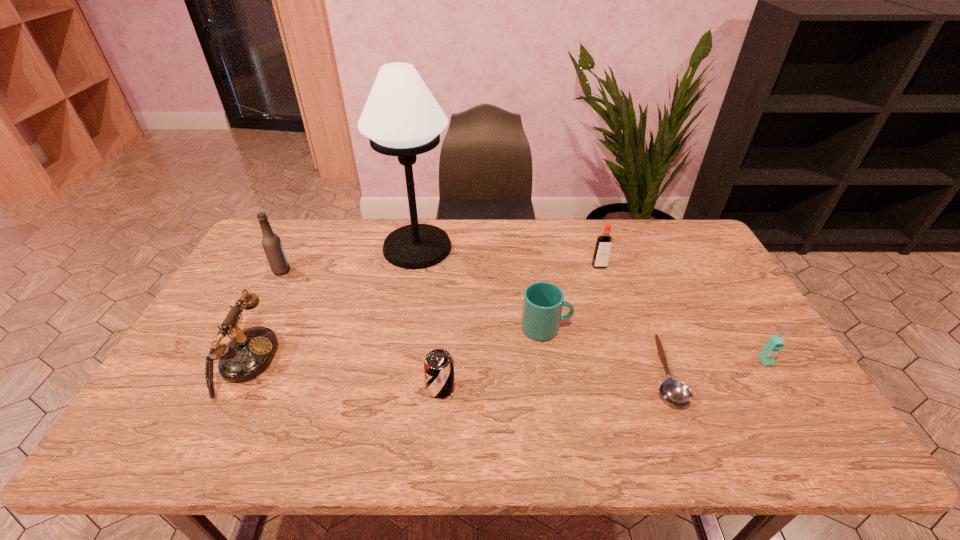
At what (x,y) coordinates should I click in order to perform the action: click on object that is at the right edge. Please return your answer as a coordinate pair (x, y). Looking at the image, I should click on (775, 343).

In the image, there is a desktop. Where is `free space at the far edge`? This screenshot has width=960, height=540. free space at the far edge is located at coordinates (383, 246).

Find the location of a particular element. Image resolution: width=960 pixels, height=540 pixels. free space at the near edge of the desktop is located at coordinates (385, 449).

Locate an element on the screen. This screenshot has width=960, height=540. free region at the left edge of the desktop is located at coordinates (229, 294).

The image size is (960, 540). I want to click on vacant area at the near left corner, so click(x=159, y=441).

Where is `blank space at the far right corner of the desktop`? This screenshot has width=960, height=540. blank space at the far right corner of the desktop is located at coordinates (670, 226).

The height and width of the screenshot is (540, 960). In order to click on free spot between the sixth object from left to right and the second tallest object in this screenshot , I will do `click(441, 268)`.

This screenshot has height=540, width=960. Find the location of `free space between the sixth object from left to right and the ladle`. free space between the sixth object from left to right and the ladle is located at coordinates (632, 319).

You are a GUI agent. You are given a task and a screenshot of the screen. Output one action in this format:
    pyautogui.click(x=<x>, y=<y>)
    Task: Click on the free area in between the fifth object from left to right and the beer bottle
    The image size is (960, 540).
    Given the screenshot: What is the action you would take?
    pyautogui.click(x=414, y=300)

The image size is (960, 540). What are the coordinates of `free space between the cellular telephone and the fourth object from right to left` in the screenshot? It's located at [656, 345].